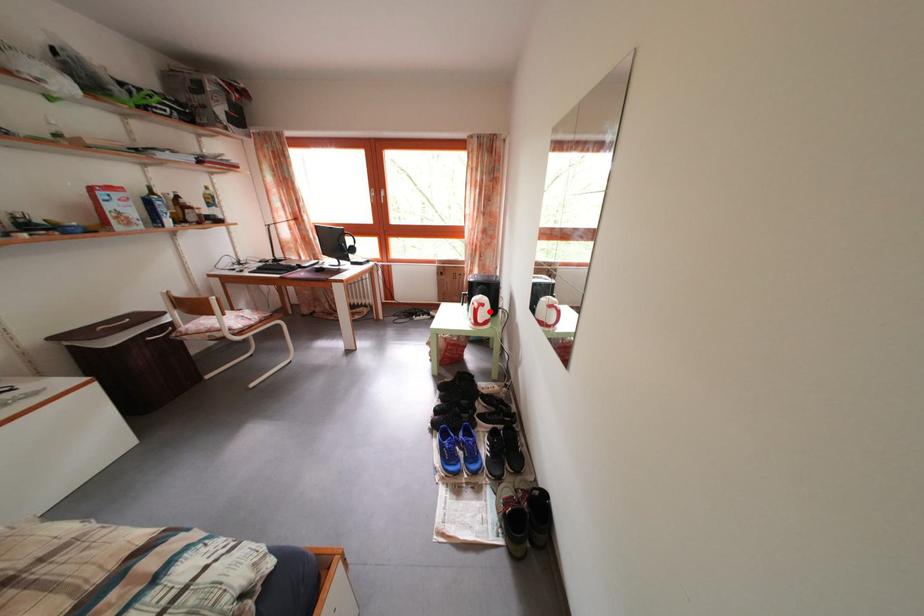
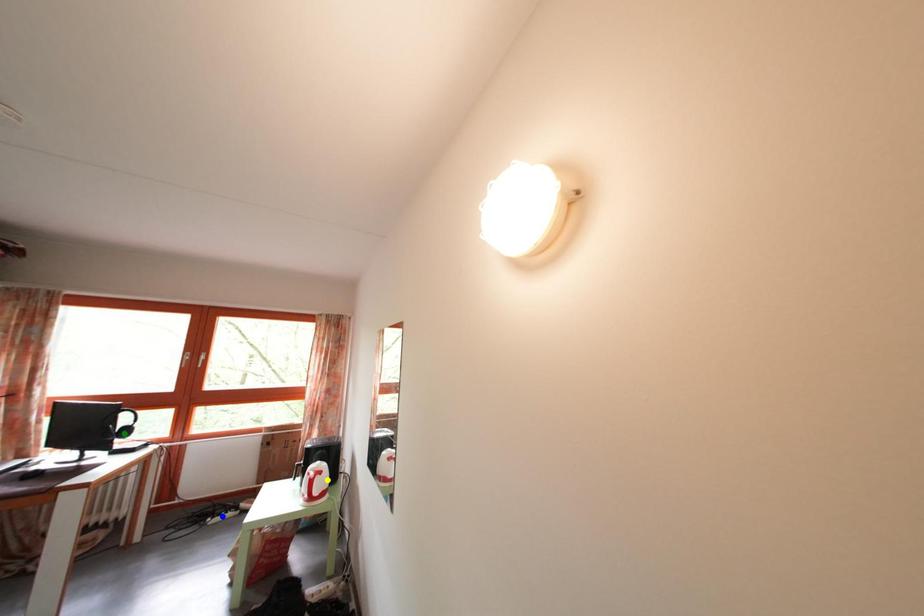
Question: I am providing you with two images of the same scene from different viewpoints. A red point is marked on the first image. You are given multiple points on the second image. Which spot in image 2 lines up with the point in image 1?

Choices:
 (A) green point
 (B) yellow point
 (C) blue point

Answer: (B)